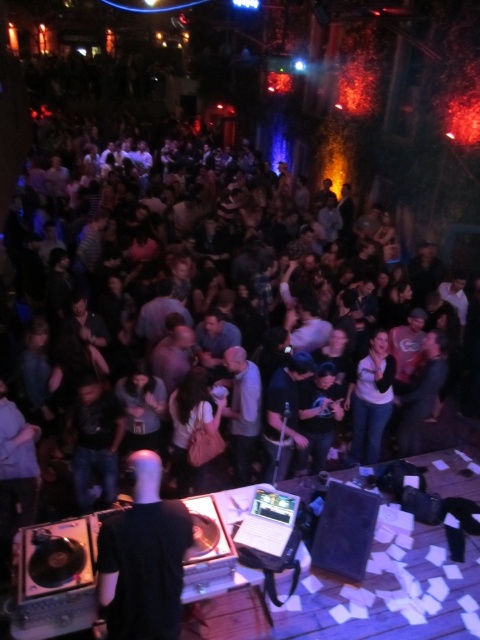
Question: Which point is farther to the camera?

Choices:
 (A) (252, 420)
 (B) (365, 376)

Answer: (B)

Question: Considering the real-world distances, which object is farthest from the light gray shirt at center?

Choices:
 (A) white matte shirt at center
 (B) black matte shirt at center

Answer: (B)

Question: Does white matte shirt at center have a larger size compared to light gray shirt at center?

Choices:
 (A) no
 (B) yes

Answer: (B)

Question: Does black matte shirt at center have a lesser width compared to white matte shirt at center?

Choices:
 (A) yes
 (B) no

Answer: (A)

Question: Which point is closer to the camera taking this photo?

Choices:
 (A) (248, 404)
 (B) (171, 586)

Answer: (B)

Question: Observing the image, what is the correct spatial positioning of black matte shirt at center in reference to white matte shirt at center?

Choices:
 (A) right
 (B) left

Answer: (B)